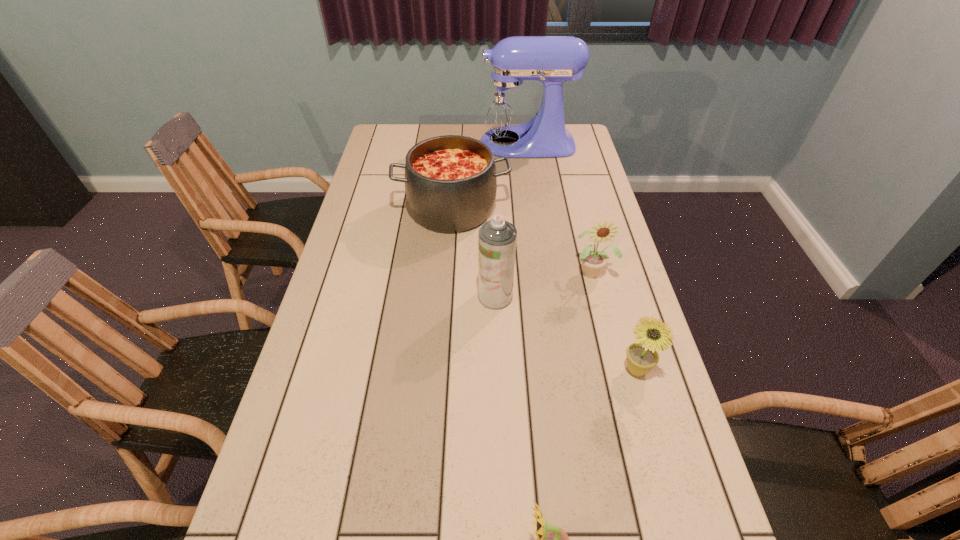
In the image, there is a desktop. What are the coordinates of `free space at the far left corner` in the screenshot? It's located at (385, 149).

Image resolution: width=960 pixels, height=540 pixels. In order to click on unoccupied area between the second farthest sunflower and the aerosol can in this screenshot , I will do `click(565, 333)`.

Where is `free space between the fifth shortest object and the mixer`? The width and height of the screenshot is (960, 540). free space between the fifth shortest object and the mixer is located at coordinates (510, 220).

Where is `free space between the aerosol can and the second farthest sunflower`? free space between the aerosol can and the second farthest sunflower is located at coordinates (565, 333).

Locate an element on the screen. free point between the fifth nearest object and the aerosol can is located at coordinates (474, 253).

Locate an element on the screen. The height and width of the screenshot is (540, 960). vacant space that's between the farthest sunflower and the second nearest sunflower is located at coordinates (614, 321).

The height and width of the screenshot is (540, 960). In order to click on free space between the fifth farthest object and the farthest sunflower in this screenshot , I will do `click(614, 321)`.

Where is `object that stands as the closest to the shortest object`? This screenshot has width=960, height=540. object that stands as the closest to the shortest object is located at coordinates (642, 356).

The height and width of the screenshot is (540, 960). Identify the location of object that stands as the third closest to the aerosol can. (642, 356).

Where is `sunflower object that ranks as the second closest to the aerosol can`? This screenshot has width=960, height=540. sunflower object that ranks as the second closest to the aerosol can is located at coordinates (642, 356).